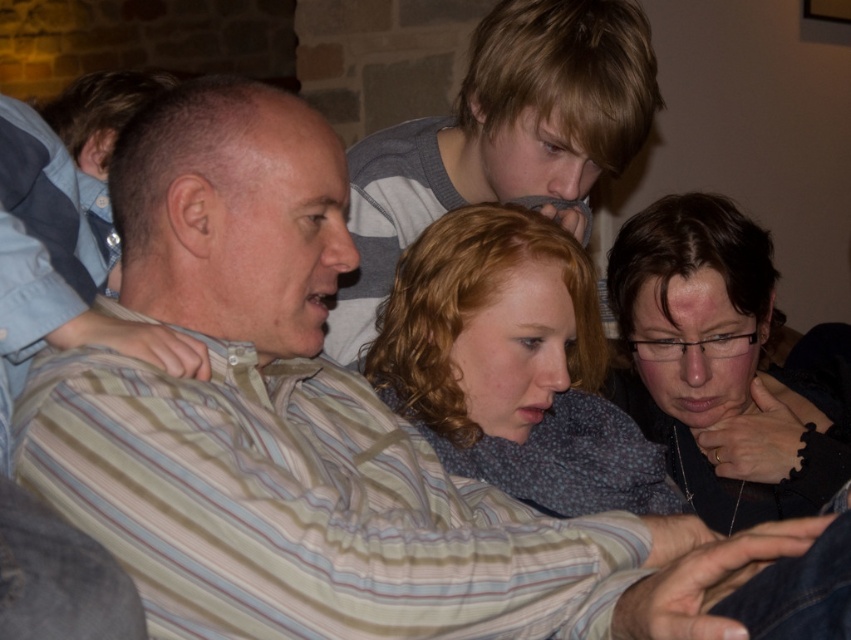
Question: Considering the relative positions of fluffy gray sweater at center and matte black glasses at lower right in the image provided, where is fluffy gray sweater at center located with respect to matte black glasses at lower right?

Choices:
 (A) right
 (B) left

Answer: (B)

Question: Among these points, which one is farthest from the camera?

Choices:
 (A) (586, 362)
 (B) (724, 280)

Answer: (A)

Question: Is fluffy gray sweater at center below matte black glasses at lower right?

Choices:
 (A) no
 (B) yes

Answer: (B)

Question: Is fluffy gray sweater at center in front of matte black glasses at lower right?

Choices:
 (A) yes
 (B) no

Answer: (A)

Question: Which object appears closest to the camera in this image?

Choices:
 (A) matte black glasses at lower right
 (B) fluffy gray sweater at center

Answer: (B)